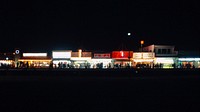
This screenshot has width=200, height=112. In order to click on circular lights in this screenshot , I will do `click(129, 32)`, `click(141, 42)`.